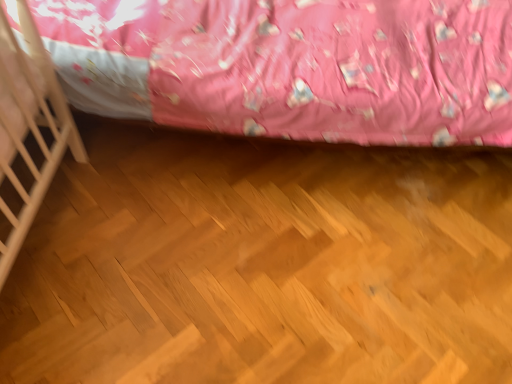
Find the location of a particular element. This screenshot has width=512, height=384. matte pink fabric at upper center is located at coordinates (292, 66).

Describe the element at coordinates (292, 66) in the screenshot. I see `matte pink fabric at upper center` at that location.

Where is `matte pink fabric at upper center`? matte pink fabric at upper center is located at coordinates (292, 66).